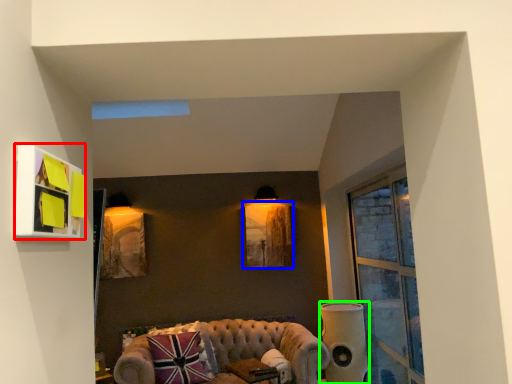
Question: Which object is the farthest from picture frame (highlighted by a red box)? Choose among these: picture frame (highlighted by a blue box) or speaker (highlighted by a green box).

Choices:
 (A) picture frame
 (B) speaker

Answer: (A)